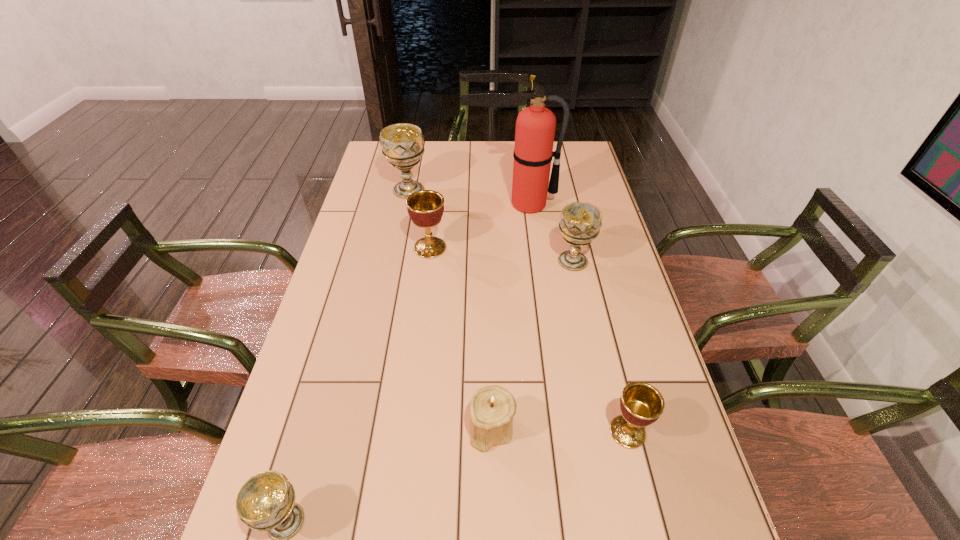
This screenshot has height=540, width=960. Find the location of `the tallest object`. the tallest object is located at coordinates (535, 126).

Identify the location of fire extinguisher. The height and width of the screenshot is (540, 960). (535, 126).

This screenshot has height=540, width=960. Find the location of `the biggest white chalice`. the biggest white chalice is located at coordinates (402, 144).

The width and height of the screenshot is (960, 540). I want to click on the second tallest object, so (x=402, y=144).

Identify the location of the farther golden chalice. This screenshot has width=960, height=540. (425, 207).

The height and width of the screenshot is (540, 960). Identify the location of the bigger golden chalice. (425, 207).

The width and height of the screenshot is (960, 540). In order to click on the second smallest white chalice in this screenshot , I will do `click(580, 223)`.

Find the location of `the second farthest white chalice`. the second farthest white chalice is located at coordinates (580, 223).

Image resolution: width=960 pixels, height=540 pixels. Find the location of `the fourth object from left to right`. the fourth object from left to right is located at coordinates (492, 408).

Where is `beige candle_holder`? beige candle_holder is located at coordinates (492, 408).